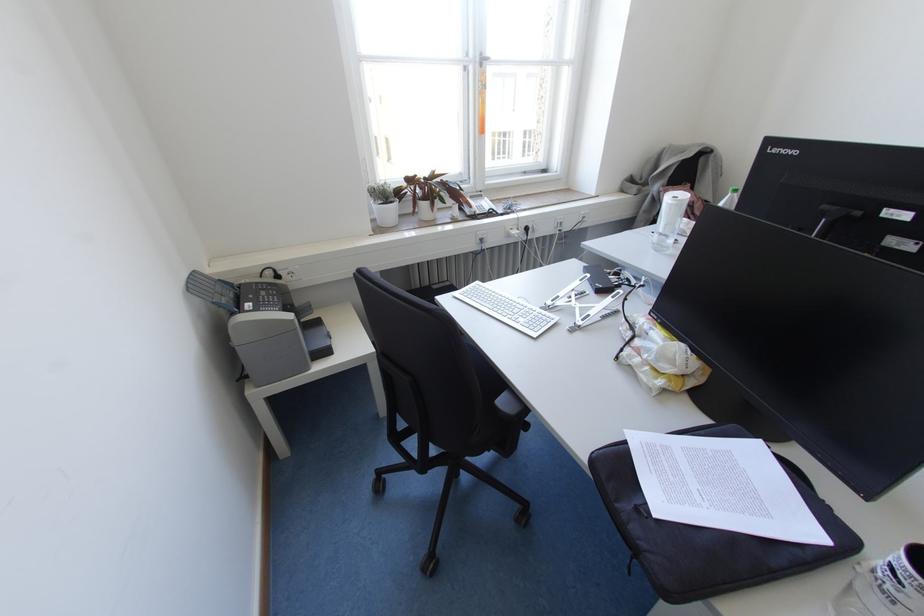
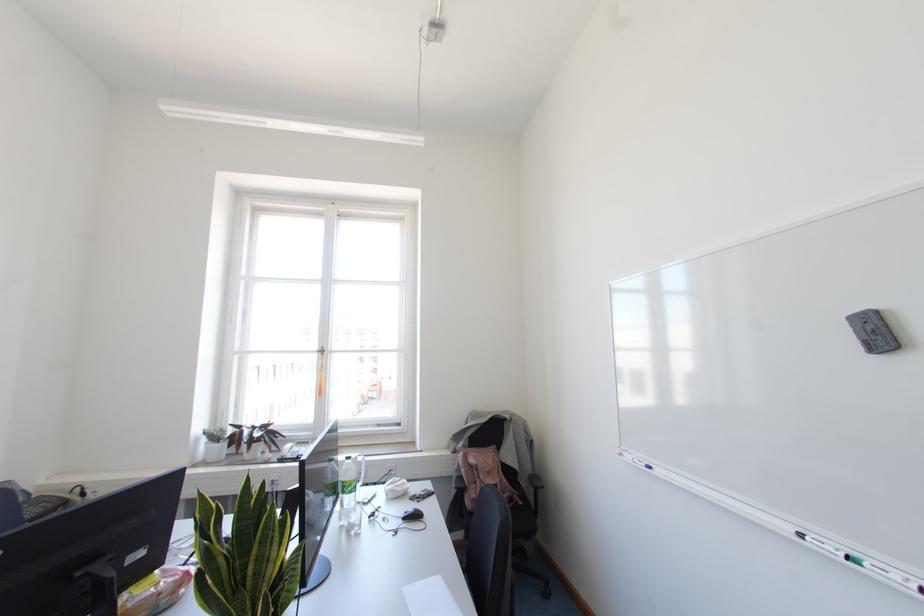
The point at (390, 187) is marked in the first image. Where is the corresponding point in the second image?

(223, 431)